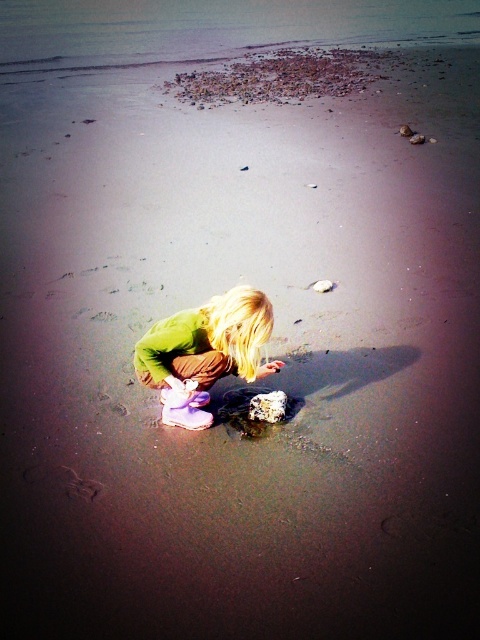
You are a photographer trying to capture the child in the scene. You want to ensure both the green fabric shirt at center and the smooth gray rock at lower center are clearly visible in the frame. Given their sizes, which object should you focus on to ensure both are in focus?

The green fabric shirt at center is larger than the smooth gray rock at lower center. By focusing on the green fabric shirt at center, you can ensure that both objects are within the depth of field and clearly visible in the photograph.

You are a photographer trying to capture the child in the scene. The child is wearing a green fabric shirt at center and near a smooth gray rock at lower center. To ensure both the shirt and the rock are in focus, where should you position your camera focus point?

The green fabric shirt at center is located above the smooth gray rock at lower center. Therefore, positioning the camera focus point on the green fabric shirt at center will ensure both the shirt and the rock are in focus since they are at different vertical levels but within the same focal plane.

You are a photographer standing at the edge of the beach. You want to capture the green fabric shirt at center in your shot. Where should you position your camera relative to the point marked at coordinates point (204, 353) to ensure the shirt is centered in the frame?

The green fabric shirt at center is already represented by the point at coordinates point (204, 353), so positioning the camera directly at that point would center the shirt in the frame.